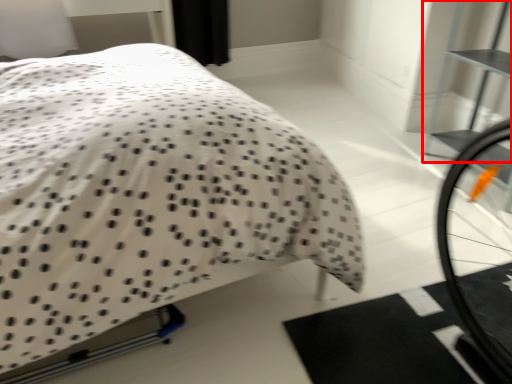
Question: Considering the relative positions of bookshelf (annotated by the red box) and bed in the image provided, where is bookshelf (annotated by the red box) located with respect to the staircase?

Choices:
 (A) right
 (B) left

Answer: (A)